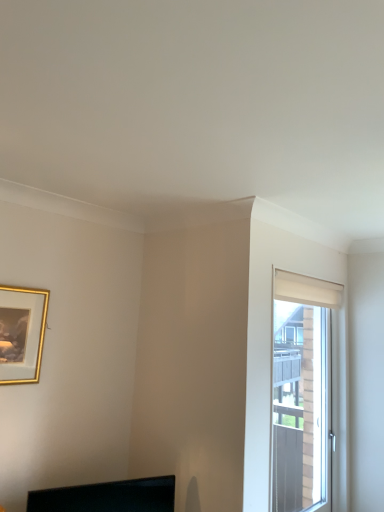
You are a GUI agent. You are given a task and a screenshot of the screen. Output one action in this format:
    pyautogui.click(x=<x>, y=<y>)
    Task: Click on the gold-framed picture at upper left
    The width and height of the screenshot is (384, 512).
    Given the screenshot: What is the action you would take?
    pyautogui.click(x=21, y=333)

Locate an element on the screen. The image size is (384, 512). black glossy monitor at lower center is located at coordinates (108, 497).

Considering the relative positions of black glossy monitor at lower center and white matte window at right in the image provided, is black glossy monitor at lower center to the left or to the right of white matte window at right?

In the image, black glossy monitor at lower center appears on the left side of white matte window at right.

How different are the orientations of black glossy monitor at lower center and white matte window at right in degrees?

24.2 degrees separate the facing orientations of black glossy monitor at lower center and white matte window at right.

Is black glossy monitor at lower center aimed at white matte window at right?

No, black glossy monitor at lower center is not oriented towards white matte window at right.

Where is `window that is behind the black glossy monitor at lower center`? Image resolution: width=384 pixels, height=512 pixels. window that is behind the black glossy monitor at lower center is located at coordinates (301, 392).

Is white matte window at right further to camera compared to black glossy monitor at lower center?

Yes.

Considering the relative positions of white matte window at right and black glossy monitor at lower center in the image provided, is white matte window at right to the right of black glossy monitor at lower center from the viewer's perspective?

Indeed, white matte window at right is positioned on the right side of black glossy monitor at lower center.

From a real-world perspective, is white matte window at right above or below black glossy monitor at lower center?

From a real-world perspective, white matte window at right is physically above black glossy monitor at lower center.

Which is closer to the camera, (286, 391) or (139, 503)?

The point (139, 503) is more forward.

Is gold-framed picture at upper left positioned far away from black glossy monitor at lower center?

Actually, gold-framed picture at upper left and black glossy monitor at lower center are a little close together.

From the image's perspective, is gold-framed picture at upper left located beneath black glossy monitor at lower center?

No, from the image's perspective, gold-framed picture at upper left is not below black glossy monitor at lower center.

Between gold-framed picture at upper left and black glossy monitor at lower center, which one has smaller size?

Smaller between the two is gold-framed picture at upper left.

Between point (280, 473) and point (0, 309), which one is positioned behind?

Point (280, 473)

Considering the sizes of objects white matte window at right and gold-framed picture at upper left in the image provided, who is taller, white matte window at right or gold-framed picture at upper left?

With more height is white matte window at right.

Is white matte window at right inside or outside of gold-framed picture at upper left?

white matte window at right lies outside gold-framed picture at upper left.

Is white matte window at right at the right side of gold-framed picture at upper left?

Indeed, white matte window at right is positioned on the right side of gold-framed picture at upper left.

Is gold-framed picture at upper left looking in the opposite direction of white matte window at right?

No, gold-framed picture at upper left is not facing the opposite direction of white matte window at right.

From the picture: Which is closer, (29, 313) or (313, 451)?

Point (29, 313).

Considering the relative sizes of gold-framed picture at upper left and white matte window at right in the image provided, is gold-framed picture at upper left thinner than white matte window at right?

Correct, the width of gold-framed picture at upper left is less than that of white matte window at right.

You are a GUI agent. You are given a task and a screenshot of the screen. Output one action in this format:
    pyautogui.click(x=<x>, y=<y>)
    Task: Click on the picture frame on the left of the white matte window at right
    
    Given the screenshot: What is the action you would take?
    pyautogui.click(x=21, y=333)

From a real-world perspective, which object stands above the other?

In real-world perspective, gold-framed picture at upper left is above.

Is black glossy monitor at lower center positioned beyond the bounds of gold-framed picture at upper left?

black glossy monitor at lower center lies outside gold-framed picture at upper left's area.

I want to click on picture frame behind the black glossy monitor at lower center, so click(x=21, y=333).

Consider the image. Is black glossy monitor at lower center not near gold-framed picture at upper left?

No, black glossy monitor at lower center is not far away from gold-framed picture at upper left.

Locate an element on the screen. The width and height of the screenshot is (384, 512). window behind the black glossy monitor at lower center is located at coordinates (301, 392).

In the image, there is a white matte window at right. At what (x,y) coordinates should I click in order to perform the action: click on computer monitor below it (from the image's perspective). Please return your answer as a coordinate pair (x, y). The width and height of the screenshot is (384, 512). Looking at the image, I should click on (108, 497).

Considering their positions, is gold-framed picture at upper left positioned closer to black glossy monitor at lower center than white matte window at right?

gold-framed picture at upper left.

From the image, which object appears to be farther from white matte window at right, gold-framed picture at upper left or black glossy monitor at lower center?

gold-framed picture at upper left is positioned further to the anchor white matte window at right.

When comparing their distances from white matte window at right, does black glossy monitor at lower center or gold-framed picture at upper left seem further?

gold-framed picture at upper left is further to white matte window at right.

Looking at the image, which one is located closer to gold-framed picture at upper left, white matte window at right or black glossy monitor at lower center?

black glossy monitor at lower center is positioned closer to the anchor gold-framed picture at upper left.

Considering their positions, is black glossy monitor at lower center positioned further to gold-framed picture at upper left than white matte window at right?

white matte window at right is further to gold-framed picture at upper left.

From the image, which object appears to be nearer to black glossy monitor at lower center, white matte window at right or gold-framed picture at upper left?

gold-framed picture at upper left lies closer to black glossy monitor at lower center than the other object.

What are the coordinates of `computer monitor located between gold-framed picture at upper left and white matte window at right in the left-right direction` in the screenshot? It's located at (108, 497).